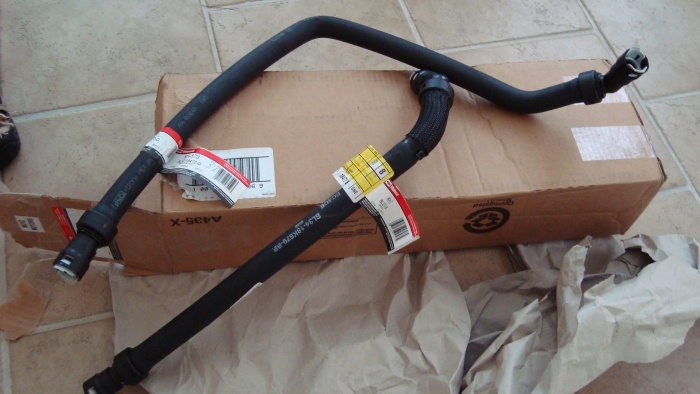
I want to click on cardboard box, so click(x=533, y=182).